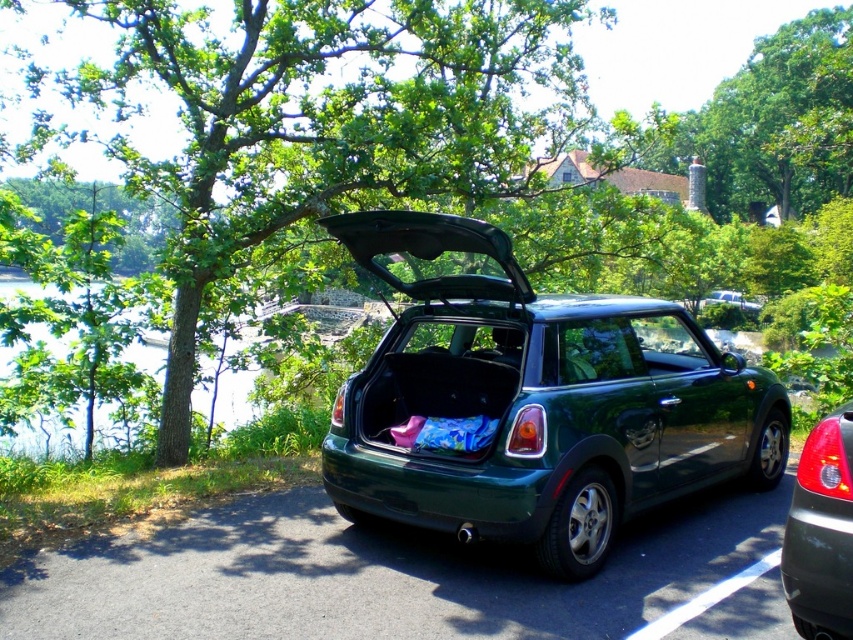
Looking at this image, you are standing at the center of the paved area near the dark green Mini Cooper. Looking towards the green leafy tree at upper left, can you determine its position relative to your current location?

The green leafy tree at upper left is located at point coordinates approximately 0.194 on the x axis and 0.380 on the y axis, so it is positioned to the upper left direction from your current location at the center of the paved area.

Looking at this image, you are standing at the center of the image and want to locate the green leafy tree at upper left. According to the coordinates provided, in which direction should you look to find it?

The green leafy tree at upper left is located at coordinates point (323, 124), so you should look to the upper left direction to find it.